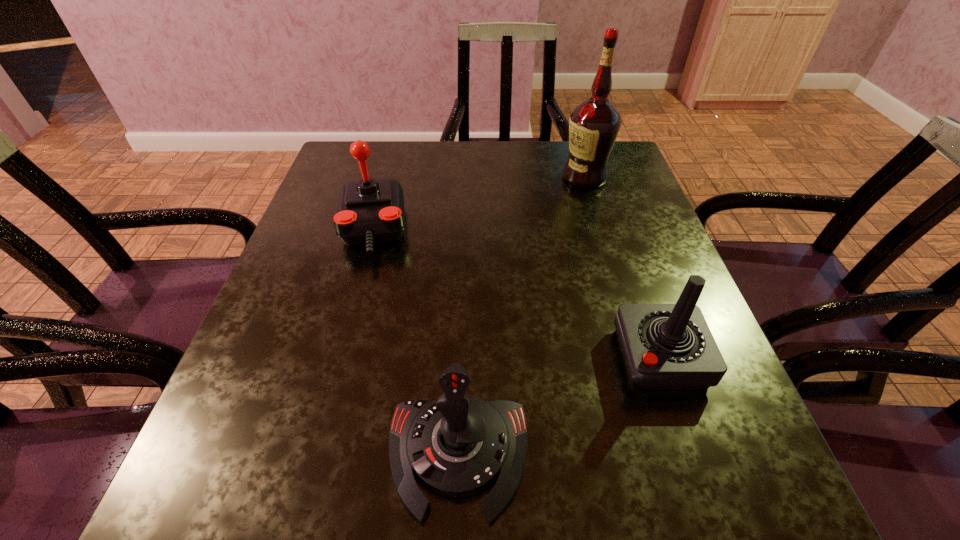
Identify the location of object situated at the far right corner. (594, 125).

In the image, there is a desktop. At what (x,y) coordinates should I click in order to perform the action: click on free region at the far edge. Please return your answer as a coordinate pair (x, y). The image size is (960, 540). Looking at the image, I should click on (396, 155).

The height and width of the screenshot is (540, 960). I want to click on free location at the near edge, so click(x=393, y=489).

Where is `vacant space at the left edge of the desktop`? vacant space at the left edge of the desktop is located at coordinates (276, 399).

The height and width of the screenshot is (540, 960). What are the coordinates of `free space at the far left corner` in the screenshot? It's located at click(x=331, y=168).

You are a GUI agent. You are given a task and a screenshot of the screen. Output one action in this format:
    pyautogui.click(x=<x>, y=<y>)
    Task: Click on the free space at the near left corner
    The width and height of the screenshot is (960, 540).
    Given the screenshot: What is the action you would take?
    pyautogui.click(x=291, y=522)

The width and height of the screenshot is (960, 540). Find the location of `free space at the near right corner of the desktop`. free space at the near right corner of the desktop is located at coordinates click(x=763, y=526).

Locate an element on the screen. This screenshot has width=960, height=540. vacant space in between the alcohol and the third object from right to left is located at coordinates point(521,316).

The height and width of the screenshot is (540, 960). Identify the location of free point between the leftmost joystick and the third farthest object. (516, 293).

Where is `free spot between the second farthest object and the alcohol`? This screenshot has height=540, width=960. free spot between the second farthest object and the alcohol is located at coordinates (478, 203).